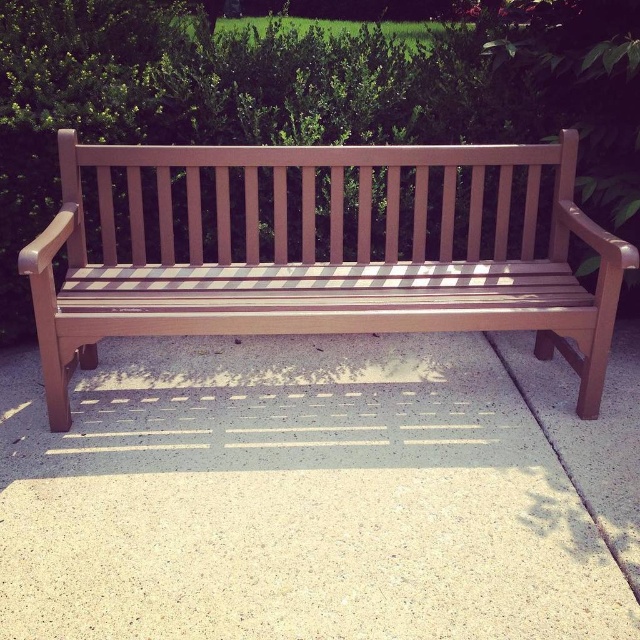
You are standing at the wooden bench in the park. You see a gray speckled concrete at center located at point (x=321, y=492). If you want to place a small potted plant on the concrete at that point, will it be in the shadow of the bench?

The gray speckled concrete at center at point (x=321, y=492) is located at the center of the concrete surface. Since the bench casts an elongated shadow due to the low sun angle, the shadow likely covers the area around the bench. However, without specific shadow dimensions, it is uncertain if the exact point is shaded. Further information is needed to determine this.